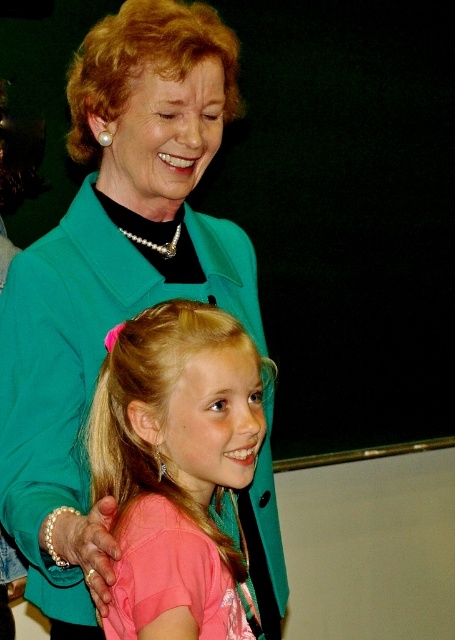
You are attending a formal event and want to take a photo with both the pink satin dress at center and the blonde silky hair at upper left in the frame. Which object should you focus on to ensure both are in focus?

You should focus on the pink satin dress at center because it is in front of the blonde silky hair at upper left, so focusing on the closer object will keep both in focus.

Based on the photo, you are a photographer preparing to take a portrait of the two people in the scene. You need to ensure that both the teal fabric jacket at upper left and the blonde silky hair at upper left are fully visible in the frame. Based on their widths, which object should you prioritize positioning closer to the center to avoid being cut off?

The teal fabric jacket at upper left has a greater width than the blonde silky hair at upper left, so you should prioritize positioning the teal fabric jacket at upper left closer to the center to ensure it fits within the frame and avoid being cut off.

From the picture: You are a photographer at an event and need to position a lighting reflector to highlight both the pink satin dress at center and the blonde silky hair at upper left. Considering their sizes, which object should you place the reflector closer to?

The pink satin dress at center is thinner than the blonde silky hair at upper left, so you should place the reflector closer to the pink satin dress at center to ensure both are adequately lit.